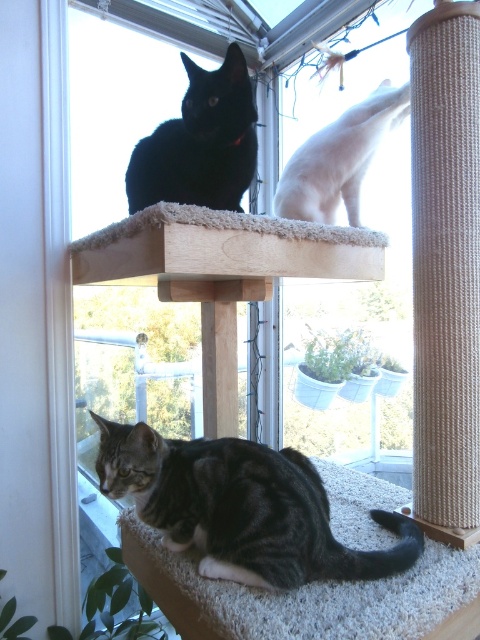
You are a small toy mouse. You are placed between the tabby fur cat at lower center and the white fur cat at upper right. Which cat is wider?

The tabby fur cat at lower center is wider than the white fur cat at upper right according to the description.

You are standing in the room and want to locate the tabby fur cat at lower center. What are the coordinates where you can find it?

The tabby fur cat at lower center is located at coordinates point (241, 508).

You are a cat owner who wants to ensure all your cats are visible from the living room entrance. The entrance is located directly in front of the cat tree. Based on their positions, which cat among the shiny black cat at upper center and the white fur cat at upper right is more likely to be seen first when entering the room?

The shiny black cat at upper center is more likely to be seen first because it is positioned closer to the entrance than the white fur cat at upper right.